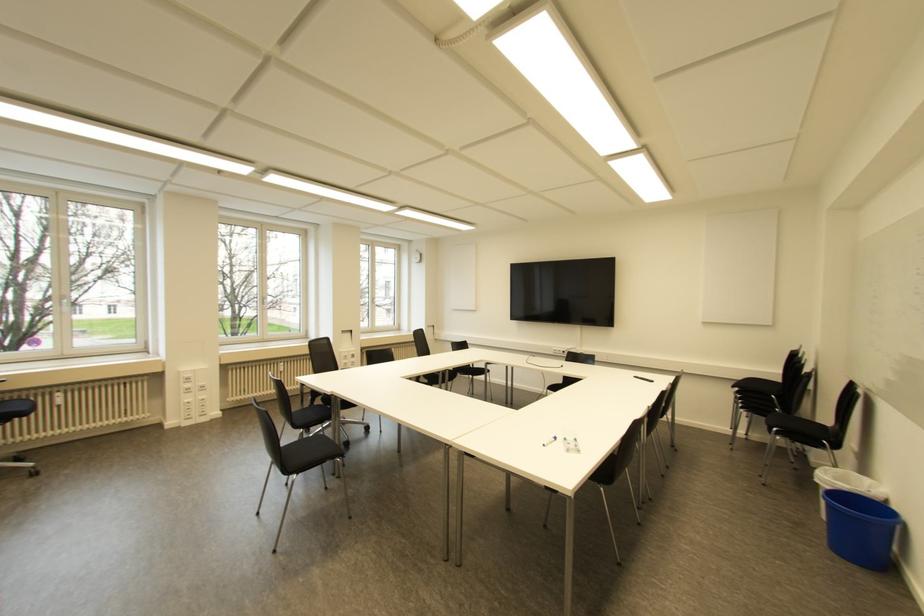
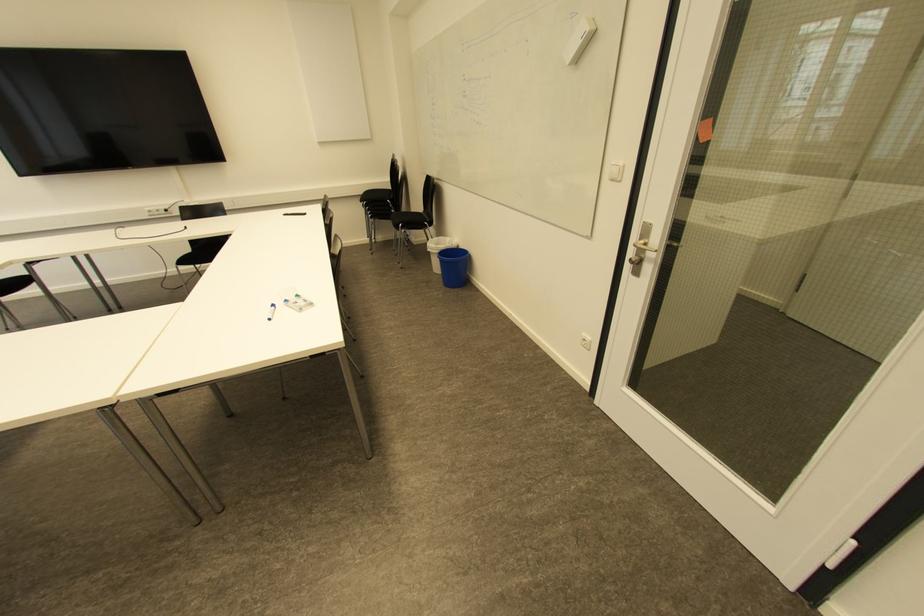
The point at (892, 505) is marked in the first image. Where is the corresponding point in the second image?

(460, 246)